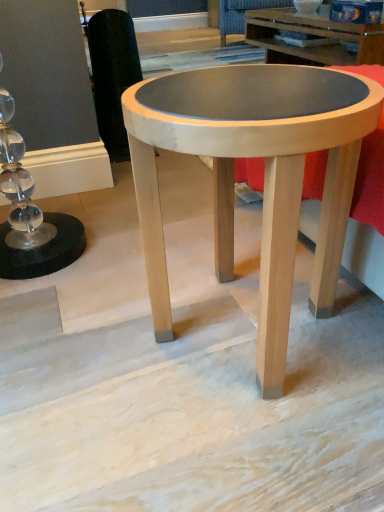
Describe the element at coordinates (265, 176) in the screenshot. Image resolution: width=384 pixels, height=512 pixels. I see `matte wood coffee table at center` at that location.

I want to click on velvet dark blue swivel chair at upper center, the 1th swivel chair in the right-to-left sequence, so click(x=242, y=14).

At what (x,y) coordinates should I click in order to perform the action: click on black fabric swivel chair at left, the 2th swivel chair when ordered from top to bottom. Please return your answer as a coordinate pair (x, y). Looking at the image, I should click on (112, 75).

Is black fabric swivel chair at left, the 2th swivel chair when ordered from top to bottom, bigger than velvet dark blue swivel chair at upper center, acting as the second swivel chair starting from the bottom?

Incorrect, black fabric swivel chair at left, the 2th swivel chair when ordered from top to bottom, is not larger than velvet dark blue swivel chair at upper center, acting as the second swivel chair starting from the bottom.

Locate an element on the screen. swivel chair that is under the black fabric swivel chair at left, arranged as the 1th swivel chair when ordered from the bottom (from a real-world perspective) is located at coordinates point(242,14).

Which is nearer, (119, 39) or (256, 5)?

The point (119, 39) is closer to the camera.

Which is behind, point (138, 70) or point (281, 244)?

Positioned behind is point (138, 70).

Does black fabric swivel chair at left, the 2th swivel chair in the back-to-front sequence, touch matte wood coffee table at center?

black fabric swivel chair at left, the 2th swivel chair in the back-to-front sequence, is not next to matte wood coffee table at center, and they're not touching.

From a real-world perspective, is black fabric swivel chair at left, which is the 1th swivel chair in left-to-right order, under matte wood coffee table at center?

No, from a real-world perspective, black fabric swivel chair at left, which is the 1th swivel chair in left-to-right order, is not beneath matte wood coffee table at center.

Is velvet dark blue swivel chair at upper center, acting as the second swivel chair starting from the bottom, further to the viewer compared to matte wood coffee table at center?

That is True.

Looking at the image, does velvet dark blue swivel chair at upper center, the 1th swivel chair when ordered from top to bottom, seem bigger or smaller compared to matte wood coffee table at center?

velvet dark blue swivel chair at upper center, the 1th swivel chair when ordered from top to bottom, is bigger than matte wood coffee table at center.

From a real-world perspective, is velvet dark blue swivel chair at upper center, the 1th swivel chair in the right-to-left sequence, beneath matte wood coffee table at center?

Correct, in the physical world, velvet dark blue swivel chair at upper center, the 1th swivel chair in the right-to-left sequence, is lower than matte wood coffee table at center.

Between velvet dark blue swivel chair at upper center, acting as the second swivel chair starting from the bottom, and matte wood coffee table at center, which one has more height?

matte wood coffee table at center is taller.

Which object is wider, matte wood coffee table at center or black fabric swivel chair at left, placed as the first swivel chair when sorted from front to back?

matte wood coffee table at center.

Considering the relative sizes of matte wood coffee table at center and black fabric swivel chair at left, the 2th swivel chair in the back-to-front sequence, in the image provided, is matte wood coffee table at center smaller than black fabric swivel chair at left, the 2th swivel chair in the back-to-front sequence,?

No, matte wood coffee table at center is not smaller than black fabric swivel chair at left, the 2th swivel chair in the back-to-front sequence.

Considering the points (153, 259) and (109, 68), which point is in front, point (153, 259) or point (109, 68)?

The point (153, 259) is closer.

How much distance is there between matte wood coffee table at center and velvet dark blue swivel chair at upper center, acting as the second swivel chair starting from the bottom?

3.32 meters.

Which object is closer to the camera taking this photo, matte wood coffee table at center or velvet dark blue swivel chair at upper center, the first swivel chair in the back-to-front sequence?

matte wood coffee table at center is in front.

From a real-world perspective, is matte wood coffee table at center on velvet dark blue swivel chair at upper center, the first swivel chair in the back-to-front sequence?

Yes, from a real-world perspective, matte wood coffee table at center is above velvet dark blue swivel chair at upper center, the first swivel chair in the back-to-front sequence.

From their relative heights in the image, would you say matte wood coffee table at center is taller or shorter than velvet dark blue swivel chair at upper center, the 1th swivel chair when ordered from top to bottom?

Clearly, matte wood coffee table at center is taller compared to velvet dark blue swivel chair at upper center, the 1th swivel chair when ordered from top to bottom.

Between velvet dark blue swivel chair at upper center, acting as the second swivel chair starting from the bottom, and black fabric swivel chair at left, arranged as the 1th swivel chair when ordered from the bottom, which one has more height?

With more height is black fabric swivel chair at left, arranged as the 1th swivel chair when ordered from the bottom.

Which object is positioned more to the left, velvet dark blue swivel chair at upper center, the 1th swivel chair in the right-to-left sequence, or black fabric swivel chair at left, arranged as the 1th swivel chair when ordered from the bottom?

black fabric swivel chair at left, arranged as the 1th swivel chair when ordered from the bottom.

Considering the relative positions of velvet dark blue swivel chair at upper center, the 1th swivel chair in the right-to-left sequence, and black fabric swivel chair at left, the 2th swivel chair when ordered from top to bottom, in the image provided, is velvet dark blue swivel chair at upper center, the 1th swivel chair in the right-to-left sequence, behind black fabric swivel chair at left, the 2th swivel chair when ordered from top to bottom,?

That is True.

Does point (266, 0) lie behind point (129, 153)?

Yes.

Identify the location of swivel chair on the left of the velvet dark blue swivel chair at upper center, which appears as the second swivel chair when viewed from the front. (112, 75).

At what (x,y) coordinates should I click in order to perform the action: click on coffee table lying on the right of black fabric swivel chair at left, which is the 1th swivel chair in left-to-right order. Please return your answer as a coordinate pair (x, y). Image resolution: width=384 pixels, height=512 pixels. Looking at the image, I should click on (265, 176).

Looking at the image, which one is located closer to matte wood coffee table at center, velvet dark blue swivel chair at upper center, the 1th swivel chair when ordered from top to bottom, or black fabric swivel chair at left, the 2th swivel chair in the back-to-front sequence?

black fabric swivel chair at left, the 2th swivel chair in the back-to-front sequence.

When comparing their distances from black fabric swivel chair at left, the 2th swivel chair when ordered from top to bottom, does velvet dark blue swivel chair at upper center, the 1th swivel chair when ordered from top to bottom, or matte wood coffee table at center seem further?

velvet dark blue swivel chair at upper center, the 1th swivel chair when ordered from top to bottom, lies further to black fabric swivel chair at left, the 2th swivel chair when ordered from top to bottom, than the other object.

Based on their spatial positions, is black fabric swivel chair at left, which is the 1th swivel chair in left-to-right order, or velvet dark blue swivel chair at upper center, which appears as the second swivel chair when viewed from the front, further from matte wood coffee table at center?

Among the two, velvet dark blue swivel chair at upper center, which appears as the second swivel chair when viewed from the front, is located further to matte wood coffee table at center.

From the image, which object appears to be farther from black fabric swivel chair at left, arranged as the 1th swivel chair when ordered from the bottom, matte wood coffee table at center or velvet dark blue swivel chair at upper center, the first swivel chair in the back-to-front sequence?

The object further to black fabric swivel chair at left, arranged as the 1th swivel chair when ordered from the bottom, is velvet dark blue swivel chair at upper center, the first swivel chair in the back-to-front sequence.

Estimate the real-world distances between objects in this image. Which object is closer to velvet dark blue swivel chair at upper center, acting as the second swivel chair starting from the bottom, black fabric swivel chair at left, acting as the second swivel chair starting from the right, or matte wood coffee table at center?

black fabric swivel chair at left, acting as the second swivel chair starting from the right, lies closer to velvet dark blue swivel chair at upper center, acting as the second swivel chair starting from the bottom, than the other object.

Based on the photo, considering their positions, is matte wood coffee table at center positioned further to velvet dark blue swivel chair at upper center, which ranks as the second swivel chair in left-to-right order, than black fabric swivel chair at left, acting as the second swivel chair starting from the right?

matte wood coffee table at center is further to velvet dark blue swivel chair at upper center, which ranks as the second swivel chair in left-to-right order.

Image resolution: width=384 pixels, height=512 pixels. Find the location of `swivel chair located between matte wood coffee table at center and velvet dark blue swivel chair at upper center, which appears as the second swivel chair when viewed from the front, in the depth direction`. swivel chair located between matte wood coffee table at center and velvet dark blue swivel chair at upper center, which appears as the second swivel chair when viewed from the front, in the depth direction is located at coordinates (112, 75).